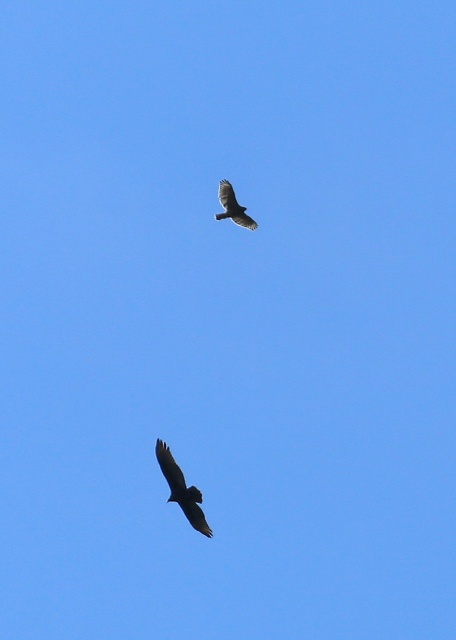
Question: Which point is farther from the camera taking this photo?

Choices:
 (A) (232, 216)
 (B) (181, 476)

Answer: (A)

Question: Which point appears farthest from the camera in this image?

Choices:
 (A) (241, 216)
 (B) (170, 493)

Answer: (A)

Question: Can you confirm if dark brown feathers at lower center is bigger than dark brown feathers at upper center?

Choices:
 (A) yes
 (B) no

Answer: (A)

Question: Can you confirm if dark brown feathers at lower center is positioned to the right of dark brown feathers at upper center?

Choices:
 (A) no
 (B) yes

Answer: (A)

Question: Can you confirm if dark brown feathers at lower center is bigger than dark brown feathers at upper center?

Choices:
 (A) yes
 (B) no

Answer: (A)